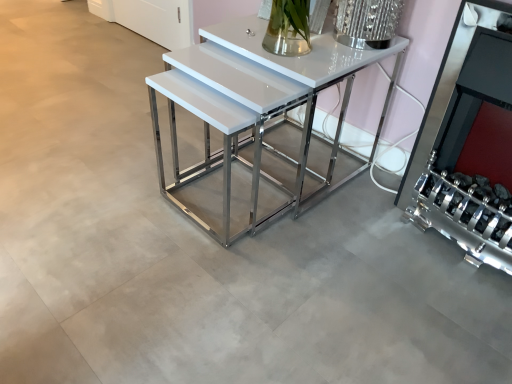
You are a GUI agent. You are given a task and a screenshot of the screen. Output one action in this format:
    pyautogui.click(x=<x>, y=<y>)
    Task: Click on the vacant space in front of silver metallic fireplace at right
    The image size is (512, 384).
    Given the screenshot: What is the action you would take?
    pyautogui.click(x=442, y=307)